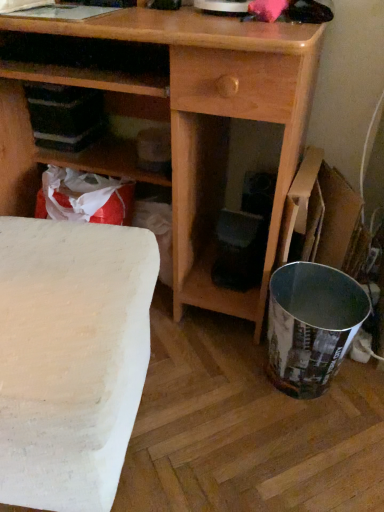
Question: Is white matte table at lower left positioned in front of cardboard box at right?

Choices:
 (A) no
 (B) yes

Answer: (B)

Question: Is white matte table at lower left touching cardboard box at right?

Choices:
 (A) yes
 (B) no

Answer: (B)

Question: Is white matte table at lower left turned away from cardboard box at right?

Choices:
 (A) yes
 (B) no

Answer: (B)

Question: From the image's perspective, is white matte table at lower left on top of cardboard box at right?

Choices:
 (A) no
 (B) yes

Answer: (A)

Question: From the image's perspective, is white matte table at lower left under cardboard box at right?

Choices:
 (A) yes
 (B) no

Answer: (A)

Question: Is white matte table at lower left wider than cardboard box at right?

Choices:
 (A) yes
 (B) no

Answer: (A)

Question: Is white matte table at lower left to the right of wooden desk at center from the viewer's perspective?

Choices:
 (A) yes
 (B) no

Answer: (B)

Question: Does white matte table at lower left have a greater height compared to wooden desk at center?

Choices:
 (A) yes
 (B) no

Answer: (B)

Question: Considering the relative sizes of white matte table at lower left and wooden desk at center in the image provided, is white matte table at lower left bigger than wooden desk at center?

Choices:
 (A) no
 (B) yes

Answer: (A)

Question: Can you confirm if white matte table at lower left is thinner than wooden desk at center?

Choices:
 (A) yes
 (B) no

Answer: (A)

Question: Does white matte table at lower left have a greater width compared to wooden desk at center?

Choices:
 (A) no
 (B) yes

Answer: (A)

Question: Is white matte table at lower left directly adjacent to wooden desk at center?

Choices:
 (A) yes
 (B) no

Answer: (B)

Question: Does wooden desk at center have a greater width compared to white matte table at lower left?

Choices:
 (A) yes
 (B) no

Answer: (A)